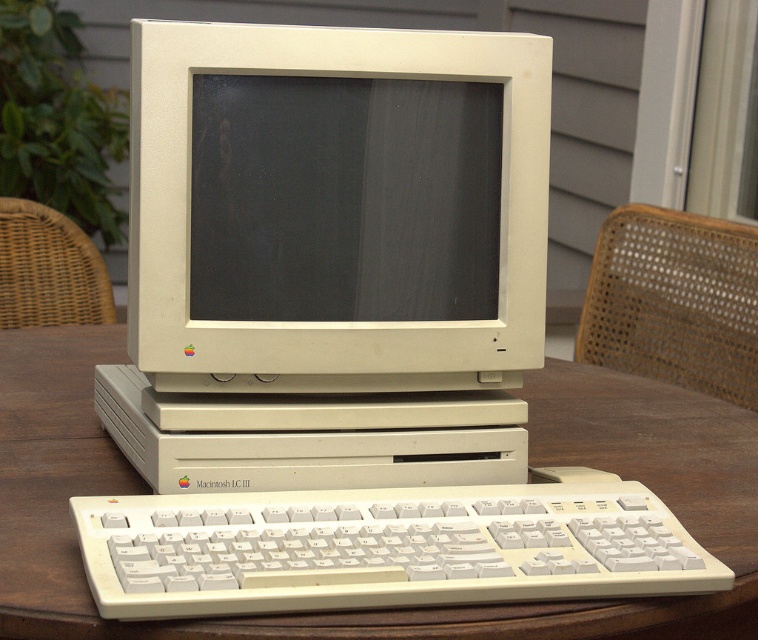
You have a white plastic keyboard at center that you want to place on the wooden table at center. Will the keyboard fit entirely on the table without hanging over the edges?

The wooden table at center is wider than the white plastic keyboard at center, so the keyboard will fit entirely on the table without hanging over the edges.

You are setting up a vintage computer display and need to arrange the white plastic monitor at center and the black matte screen at center on a shelf. The shelf has limited vertical space. Which object should you place first to ensure both fit vertically?

The white plastic monitor at center is taller than the black matte screen at center, so you should place the white plastic monitor at center first to ensure there is enough vertical space for both.